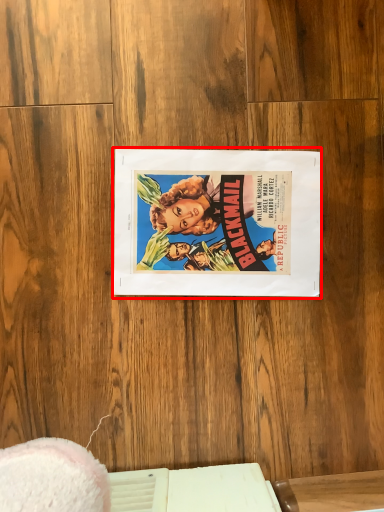
Question: From the image, what is the correct spatial relationship of paperback book (annotated by the red box) in relation to table?

Choices:
 (A) left
 (B) right

Answer: (A)